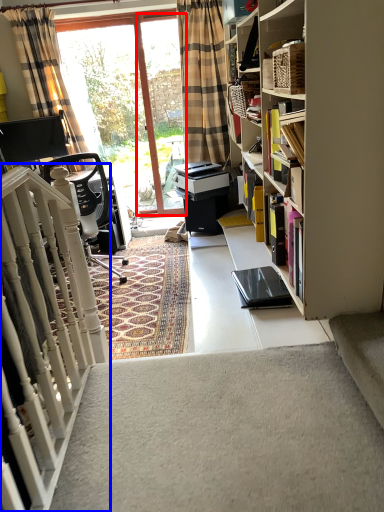
Question: Among these objects, which one is nearest to the camera, screen door (highlighted by a red box) or stairs (highlighted by a blue box)?

Choices:
 (A) screen door
 (B) stairs

Answer: (B)